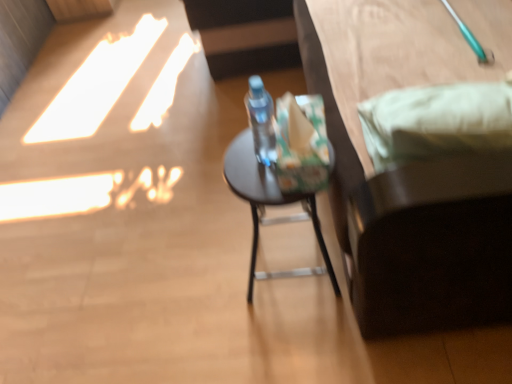
You are a GUI agent. You are given a task and a screenshot of the screen. Output one action in this format:
    pyautogui.click(x=<x>, y=<y>)
    Task: Click on the matte black stool at center
    Image resolution: width=512 pixels, height=384 pixels.
    Given the screenshot: What is the action you would take?
    pyautogui.click(x=265, y=197)

In order to click on dark brown wooden bed at right in this screenshot , I will do `click(409, 179)`.

Where is `transparent plastic bottle at center`? The image size is (512, 384). transparent plastic bottle at center is located at coordinates (261, 120).

Between transparent plastic bottle at center and matte black stool at center, which one appears on the left side from the viewer's perspective?

transparent plastic bottle at center.

Are transparent plastic bottle at center and matte black stool at center far apart?

No, there isn't a large distance between transparent plastic bottle at center and matte black stool at center.

The height and width of the screenshot is (384, 512). What are the coordinates of `desk to the right of transparent plastic bottle at center` in the screenshot? It's located at (265, 197).

Is point (264, 124) behind point (300, 196)?

That is True.

I want to click on bottle below the dark brown wooden bed at right (from the image's perspective), so click(x=261, y=120).

Considering the relative sizes of transparent plastic bottle at center and dark brown wooden bed at right in the image provided, is transparent plastic bottle at center wider than dark brown wooden bed at right?

No, transparent plastic bottle at center is not wider than dark brown wooden bed at right.

Is transparent plastic bottle at center next to dark brown wooden bed at right and touching it?

No, transparent plastic bottle at center is not in contact with dark brown wooden bed at right.

Is transparent plastic bottle at center further to camera compared to dark brown wooden bed at right?

Yes, it is behind dark brown wooden bed at right.

Is matte black stool at center wider than transparent plastic bottle at center?

Yes, matte black stool at center is wider than transparent plastic bottle at center.

From the image's perspective, between matte black stool at center and transparent plastic bottle at center, who is located below?

matte black stool at center, from the image's perspective.

Is transparent plastic bottle at center at the back of matte black stool at center?

No, matte black stool at center is not facing the opposite direction of transparent plastic bottle at center.

From a real-world perspective, who is located higher, matte black stool at center or transparent plastic bottle at center?

transparent plastic bottle at center.

Is dark brown wooden bed at right looking in the opposite direction of transparent plastic bottle at center?

No.

Which is in front, point (326, 34) or point (249, 88)?

The point (249, 88) is closer.

Which object is wider, dark brown wooden bed at right or transparent plastic bottle at center?

With larger width is dark brown wooden bed at right.

How far apart are dark brown wooden bed at right and transparent plastic bottle at center?

18.71 inches.

Which is less distant, (486,300) or (251,253)?

Point (486,300) appears to be closer to the viewer than point (251,253).

Considering the sizes of dark brown wooden bed at right and matte black stool at center in the image, is dark brown wooden bed at right taller or shorter than matte black stool at center?

Clearly, dark brown wooden bed at right is taller compared to matte black stool at center.

Can we say dark brown wooden bed at right lies outside matte black stool at center?

That's correct, dark brown wooden bed at right is outside of matte black stool at center.

Can you confirm if dark brown wooden bed at right is thinner than matte black stool at center?

In fact, dark brown wooden bed at right might be wider than matte black stool at center.

Is matte black stool at center next to dark brown wooden bed at right and touching it?

No, matte black stool at center is not in contact with dark brown wooden bed at right.

Is matte black stool at center to the left of dark brown wooden bed at right from the viewer's perspective?

Yes, matte black stool at center is to the left of dark brown wooden bed at right.

Is point (234, 164) less distant than point (319, 32)?

That is True.

From a real-world perspective, is matte black stool at center physically below dark brown wooden bed at right?

Yes, from a real-world perspective, matte black stool at center is beneath dark brown wooden bed at right.

The height and width of the screenshot is (384, 512). Identify the location of desk below the transparent plastic bottle at center (from the image's perspective). (265, 197).

The width and height of the screenshot is (512, 384). Identify the location of bottle above the dark brown wooden bed at right (from a real-world perspective). (261, 120).

When comparing their distances from transparent plastic bottle at center, does dark brown wooden bed at right or matte black stool at center seem further?

dark brown wooden bed at right.

Estimate the real-world distances between objects in this image. Which object is further from dark brown wooden bed at right, transparent plastic bottle at center or matte black stool at center?

Among the two, transparent plastic bottle at center is located further to dark brown wooden bed at right.

Based on their spatial positions, is transparent plastic bottle at center or dark brown wooden bed at right closer to matte black stool at center?

transparent plastic bottle at center.

When comparing their distances from transparent plastic bottle at center, does matte black stool at center or dark brown wooden bed at right seem closer?

Among the two, matte black stool at center is located nearer to transparent plastic bottle at center.

Looking at the image, which one is located closer to matte black stool at center, dark brown wooden bed at right or transparent plastic bottle at center?

transparent plastic bottle at center lies closer to matte black stool at center than the other object.

When comparing their distances from dark brown wooden bed at right, does matte black stool at center or transparent plastic bottle at center seem closer?

Among the two, matte black stool at center is located nearer to dark brown wooden bed at right.

The height and width of the screenshot is (384, 512). Find the location of `bottle between dark brown wooden bed at right and matte black stool at center in the up-down direction`. bottle between dark brown wooden bed at right and matte black stool at center in the up-down direction is located at coordinates (261, 120).